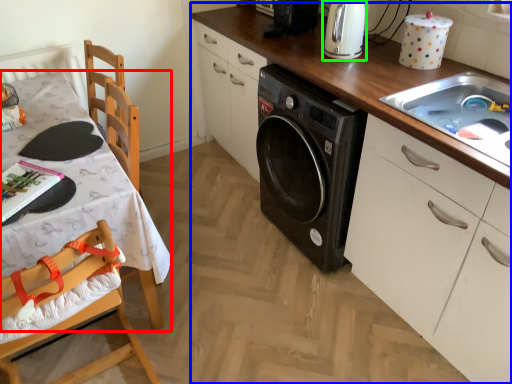
Question: Based on their relative distances, which object is farther from table (highlighted by a red box)? Choose from countertop (highlighted by a blue box) and home appliance (highlighted by a green box).

Choices:
 (A) countertop
 (B) home appliance

Answer: (B)